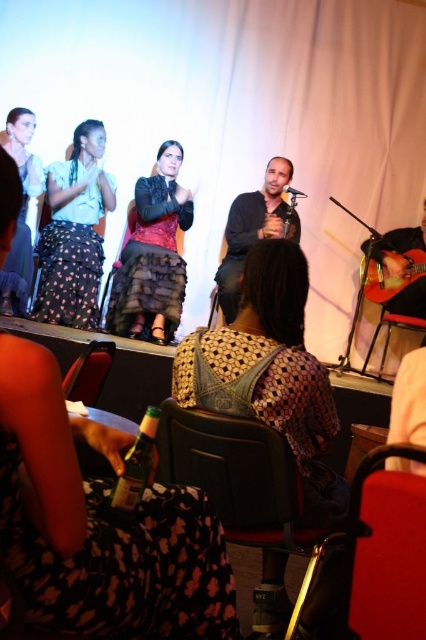
You are sitting in the theater and want to hand a flower to the person wearing the matte black skirt at left. Can you reach them from your current position at the leather seat at lower left without moving your seat?

The leather seat at lower left is behind matte black skirt at left, so you are sitting behind them. To hand the flower, you would need to move forward or have them come to you.

You are standing in the audience of the stage and want to take a photo of the point at coordinate point (x=356, y=602). The camera you are using has a minimum focus distance of 3 feet. Will the camera be able to focus on the point?

The point at coordinate point (x=356, y=602) is 3.37 feet away from the camera. Since the minimum focus distance is 3 feet, the camera can focus on the point as it is beyond the minimum required distance.